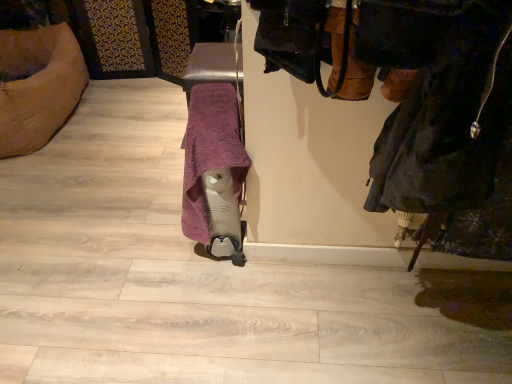
At what (x,y) coordinates should I click in order to perform the action: click on free space in front of purple soft towel at center. Please return your answer as a coordinate pair (x, y). The image size is (512, 384). Looking at the image, I should click on (212, 301).